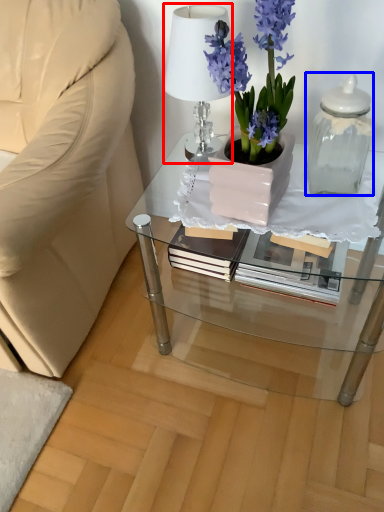
Question: Which object appears closest to the camera in this image, lamp (highlighted by a red box) or bottle (highlighted by a blue box)?

Choices:
 (A) lamp
 (B) bottle

Answer: (B)